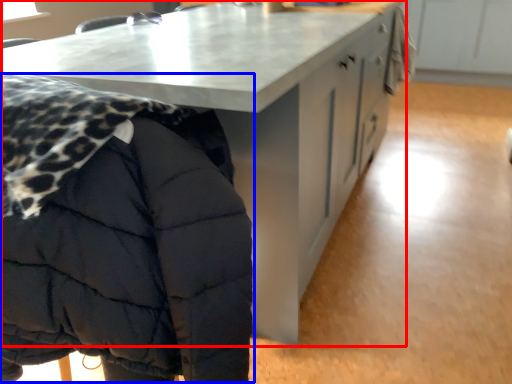
Question: Which object appears farthest to the camera in this image, table (highlighted by a red box) or jacket (highlighted by a blue box)?

Choices:
 (A) table
 (B) jacket

Answer: (A)